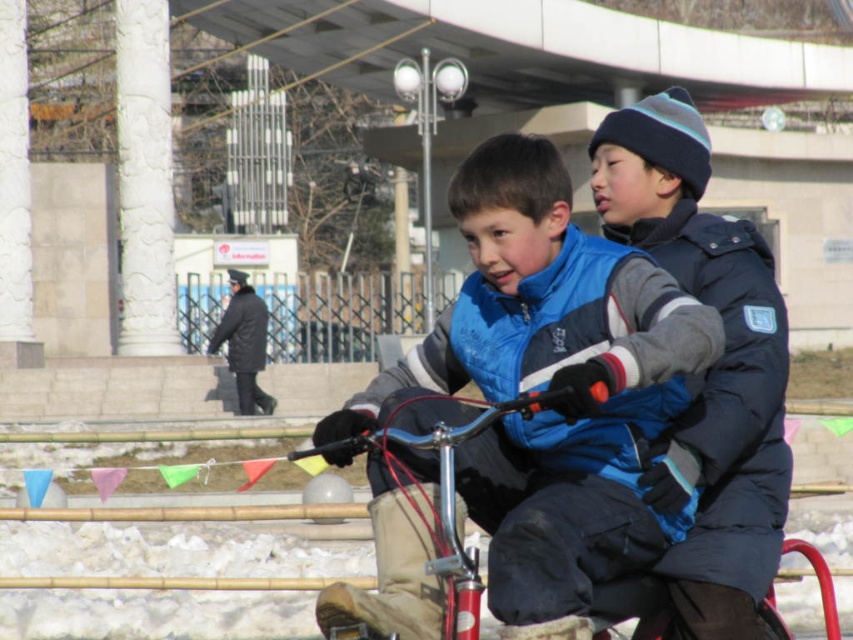
You are a photographer standing at the camera position. You want to take a photo of the blue fleece vest at center. Can you capture the entire vest in your shot if your camera has a 50mm lens? Assume the vest is 0.5 meters tall and the camera sensor can capture a field of view of 30 degrees vertically.

The blue fleece vest at center and camera are 10.11 meters apart. Using trigonometry, the vertical field of view of 30 degrees with a 50mm lens allows capturing objects up to approximately 2.68 meters tall at that distance. Since the vest is only 0.5 meters tall, it will easily fit within the frame.

You are a delivery drone flying over the scene. You need to drop a package at the exact location of the blue fleece vest at center. What are the coordinates where you should drop the package?

The coordinates for the blue fleece vest at center are at point (550, 387), so you should drop the package there.